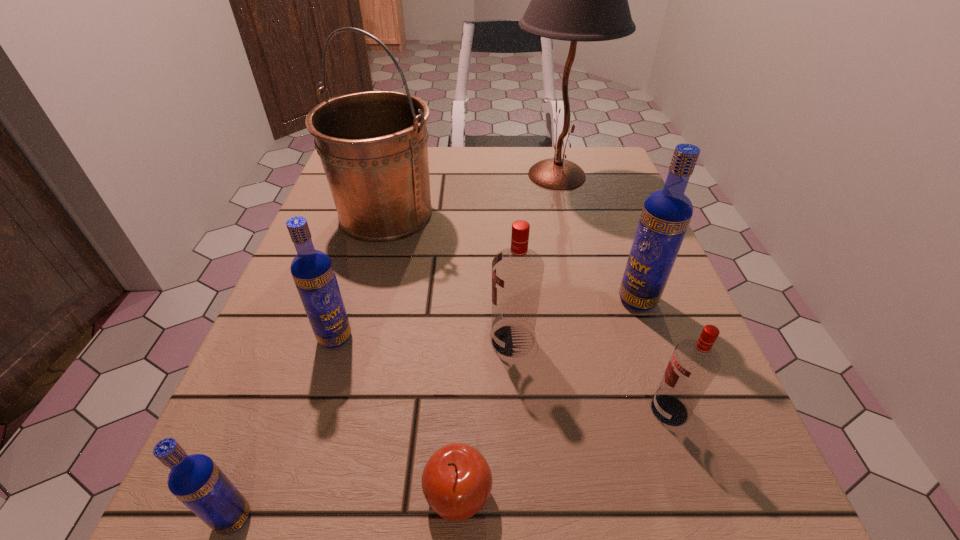
At what (x,y) coordinates should I click in order to perform the action: click on vacant space at the near right corner of the desktop. Please return your answer as a coordinate pair (x, y). The image size is (960, 540). Looking at the image, I should click on tap(711, 497).

At what (x,y) coordinates should I click in order to perform the action: click on empty space between the bucket and the apple. Please return your answer as a coordinate pair (x, y). Looking at the image, I should click on (422, 354).

Locate an element on the screen. The image size is (960, 540). vacant area that lies between the smallest blue vodka and the second smallest blue vodka is located at coordinates (284, 428).

Locate an element on the screen. Image resolution: width=960 pixels, height=540 pixels. vacant space that is in between the tallest object and the nearest blue vodka is located at coordinates (396, 347).

Find the location of a particular element. Image resolution: width=960 pixels, height=540 pixels. empty location between the tallest object and the second farthest blue vodka is located at coordinates 446,256.

I want to click on vacant area between the farther red vodka and the apple, so click(485, 417).

The height and width of the screenshot is (540, 960). What are the coordinates of `vacant area that lies between the leftmost blue vodka and the bucket` in the screenshot? It's located at (310, 366).

Locate an element on the screen. This screenshot has width=960, height=540. free space between the smallest blue vodka and the bigger red vodka is located at coordinates (373, 429).

Where is `free space between the second blue vodka from left to right and the third vodka from left to right`? Image resolution: width=960 pixels, height=540 pixels. free space between the second blue vodka from left to right and the third vodka from left to right is located at coordinates (423, 339).

The height and width of the screenshot is (540, 960). I want to click on blank region between the biggest blue vodka and the right red vodka, so click(x=654, y=355).